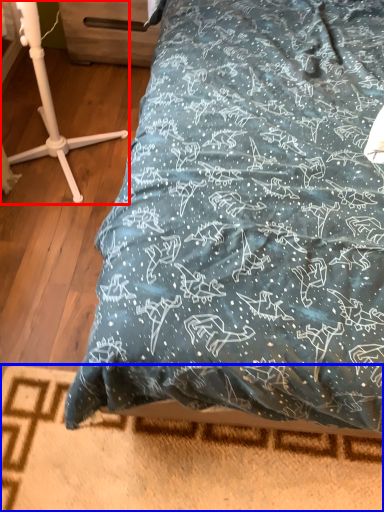
Question: Which object appears farthest to the camera in this image, furniture (highlighted by a red box) or bed frame (highlighted by a blue box)?

Choices:
 (A) furniture
 (B) bed frame

Answer: (B)